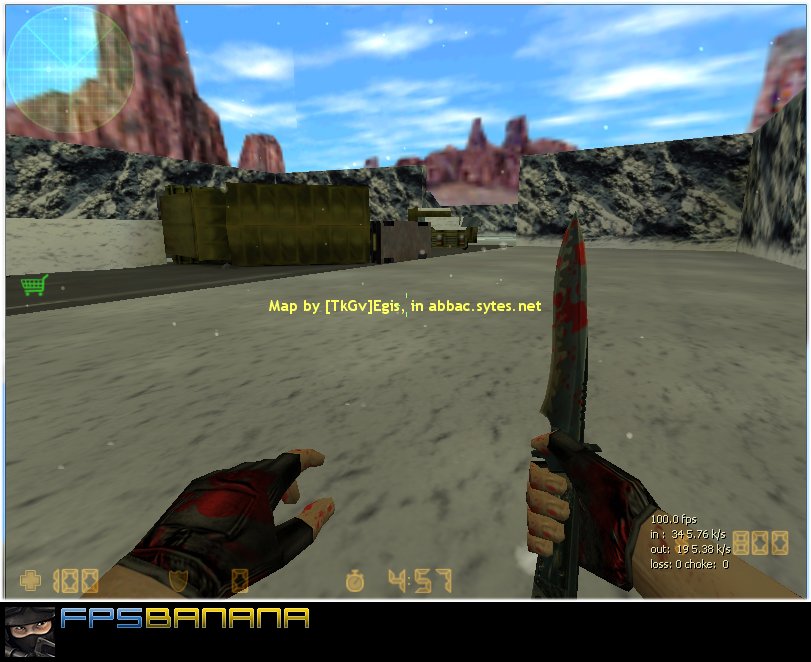
You are a GUI agent. You are given a task and a screenshot of the screen. Output one action in this format:
    pyautogui.click(x=<x>, y=<y>)
    Task: Click on the knife handle
    The height and width of the screenshot is (662, 811).
    Given the screenshot: What is the action you would take?
    pyautogui.click(x=559, y=577)